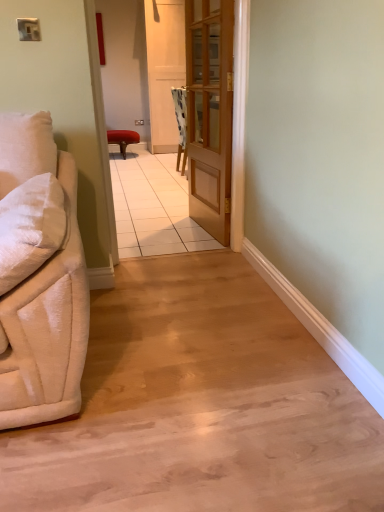
I want to click on free region under wooden door at center (from a real-world perspective), so click(171, 255).